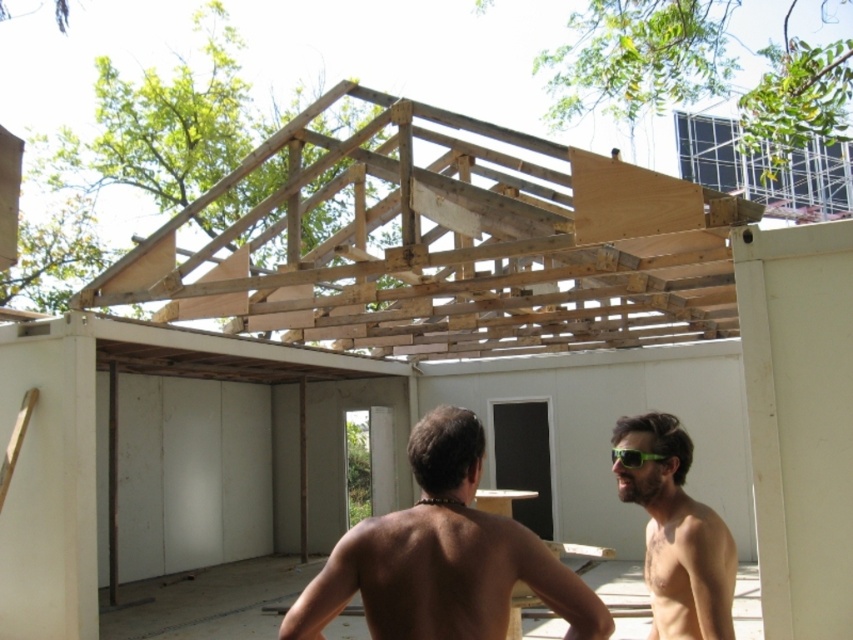
In the scene shown: Does brown skin at center have a larger size compared to green matte sunglasses at center?

Yes, brown skin at center is bigger than green matte sunglasses at center.

Between point (405, 541) and point (643, 460), which one is positioned in front?

Point (405, 541) is more forward.

Is point (463, 456) positioned behind point (614, 448)?

No, (463, 456) is closer to viewer.

The width and height of the screenshot is (853, 640). In order to click on brown skin at center in this screenshot , I will do `click(442, 556)`.

Can you confirm if natural wood roof at upper center is positioned to the left of brown skin at center?

Correct, you'll find natural wood roof at upper center to the left of brown skin at center.

Can you confirm if natural wood roof at upper center is positioned to the right of brown skin at center?

Incorrect, natural wood roof at upper center is not on the right side of brown skin at center.

The image size is (853, 640). What do you see at coordinates (445, 244) in the screenshot?
I see `natural wood roof at upper center` at bounding box center [445, 244].

Find the location of `natural wood roof at upper center`. natural wood roof at upper center is located at coordinates (445, 244).

Who is positioned more to the left, brown skin at center or green matte sunglasses at right?

brown skin at center

Identify the location of brown skin at center. Image resolution: width=853 pixels, height=640 pixels. (442, 556).

Between point (364, 541) and point (677, 534), which one is positioned in front?

Point (364, 541)

The image size is (853, 640). Identify the location of brown skin at center. (442, 556).